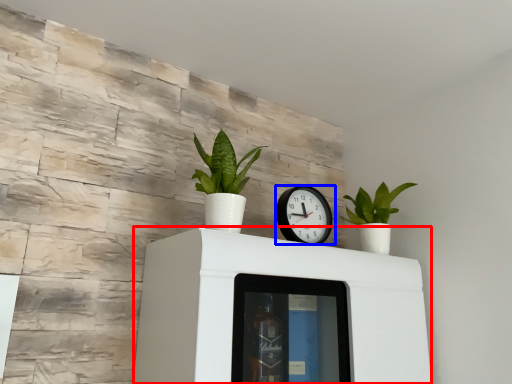
Question: Which point is further to the camera, furniture (highlighted by a red box) or wall clock (highlighted by a blue box)?

Choices:
 (A) furniture
 (B) wall clock

Answer: (B)